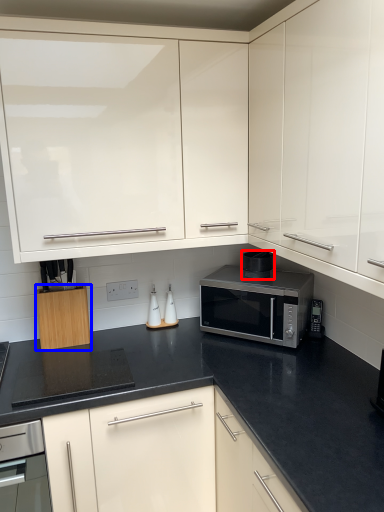
Question: Among these objects, which one is nearest to the camera, appliance (highlighted by a red box) or cabinetry (highlighted by a blue box)?

Choices:
 (A) appliance
 (B) cabinetry

Answer: (B)